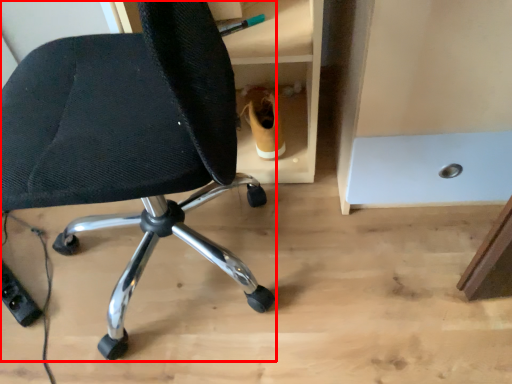
Question: Observing the image, what is the correct spatial positioning of chair (annotated by the red box) in reference to footwear?

Choices:
 (A) left
 (B) right

Answer: (A)